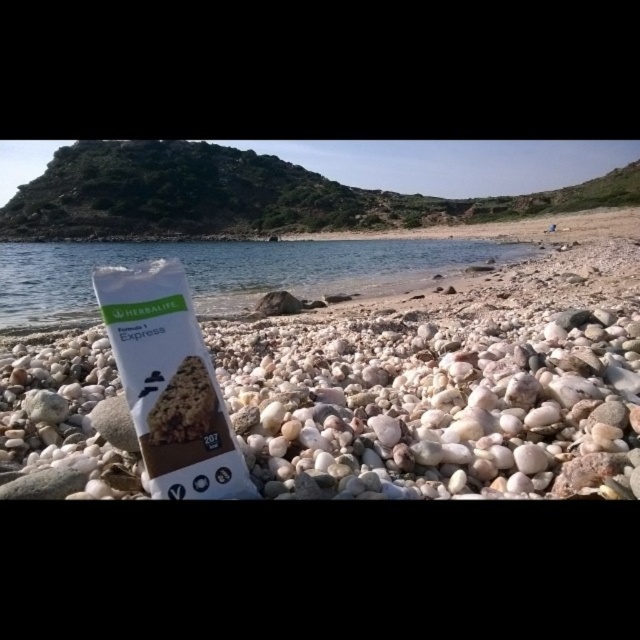
Consider the image. You are a delivery person who needs to place the white cardboard package at center on the white pebbled beach at center. Can you confirm if the package will be visible against the beach surface?

The white cardboard package at center is below the white pebbled beach at center, so it will be visible as it is placed on top of the beach surface.

You are a photographer trying to capture the Herbalife Formula 1 Express bar on a beach. You have the white pebbled beach at center and the clear water at center as backgrounds. Which background would you choose if you want the bar to stand out more?

The white pebbled beach at center is smaller than clear water at center. Since the packaging is white with green accents, using the clear water at center as a background would make the bar stand out more due to the contrast in colors and the larger area available.

You are standing on the beach looking at the Herbalife Formula 1 Express bar packaging. There are two points marked on the pebbles around the product. Which point is closer to you, point (x=230, y=296) or point (x=150, y=387)?

Point (x=150, y=387) is closer to you because it is less further to the viewer than point (x=230, y=296).